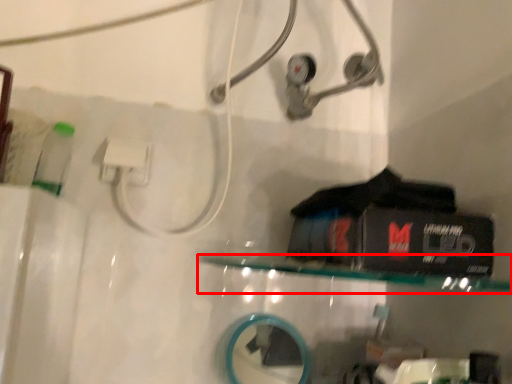
Question: In this image, where is shelf (annotated by the red box) located relative to mirror?

Choices:
 (A) right
 (B) left

Answer: (A)